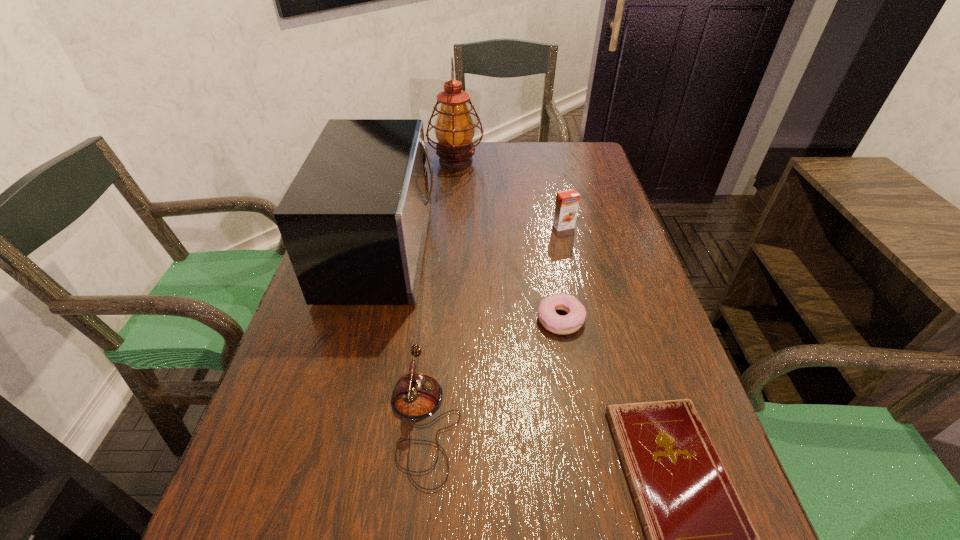
Image resolution: width=960 pixels, height=540 pixels. Identify the location of oil lamp. (454, 129).

In order to click on the farthest object in this screenshot , I will do `click(454, 129)`.

Find the location of a particular element. This screenshot has width=960, height=540. the second tallest object is located at coordinates 354,220.

The width and height of the screenshot is (960, 540). Find the location of `orange juice`. orange juice is located at coordinates (566, 207).

Identify the location of telephone. This screenshot has height=540, width=960. (416, 396).

Find the location of a particular element. Image resolution: width=960 pixels, height=540 pixels. doughnut is located at coordinates (551, 321).

Locate an element on the screen. This screenshot has height=540, width=960. vacant area situated on the left of the oil lamp is located at coordinates (372, 161).

Where is `vacant area situated with the door open on the fifth shortest object`? vacant area situated with the door open on the fifth shortest object is located at coordinates (481, 249).

What are the coordinates of `vacant space situated 0.190m on the left of the orange juice` in the screenshot? It's located at (481, 226).

At what (x,y) coordinates should I click in order to perform the action: click on vacant space located 0.310m on the rotary dial of the telephone. Please return your answer as a coordinate pair (x, y). This screenshot has height=540, width=960. Looking at the image, I should click on (641, 424).